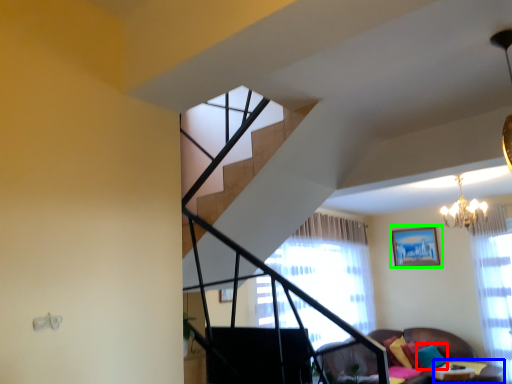
Question: Estimate the real-world distances between objects in this image. Which object is closer to pillow (highlighted by a red box), table (highlighted by a blue box) or picture frame (highlighted by a green box)?

Choices:
 (A) table
 (B) picture frame

Answer: (A)